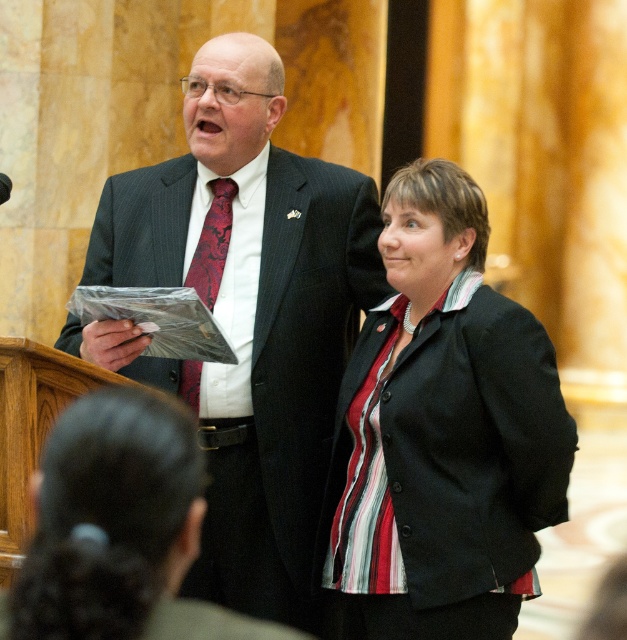
You are an interior designer planning to place two decorative items at the coordinates point (280, 221) and point (440, 337) in a room. Based on the scene, which point is further away from the viewer?

Point (280, 221) is behind point (440, 337), so it is further away from the viewer.

You are a photographer at a formal event. You need to capture a clear photo of both the striped fabric jacket at center and the shiny silk tie at center. However, you can only focus on one object at a time. Which object should you focus on first to ensure the other is still visible in the background?

You should focus on the striped fabric jacket at center first because it is in front of the shiny silk tie at center, so the tie will still be visible in the background when the jacket is in focus.

You are an interior designer assessing the color contrast between the matte black suit at center and the striped fabric jacket at center in the image. Which object has a smaller height?

The matte black suit at center has a lesser height compared to the striped fabric jacket at center.